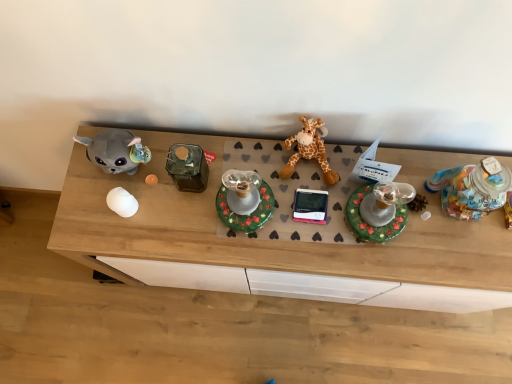
At what (x,y) coordinates should I click in order to perform the action: click on vacant space underneath orange plush giraffe at center (from a real-world perspective). Please return your answer as a coordinate pair (x, y). This screenshot has width=512, height=384. Looking at the image, I should click on (310, 163).